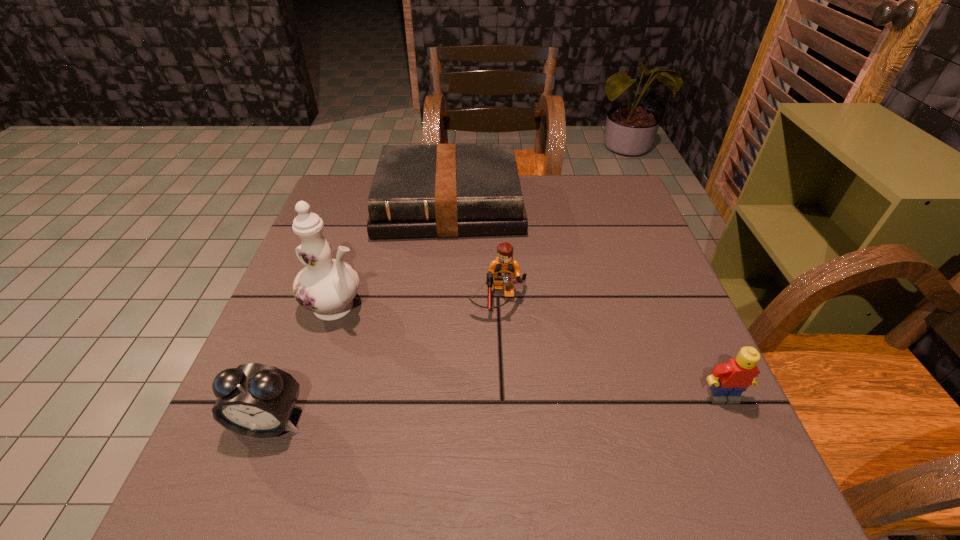
You are a GUI agent. You are given a task and a screenshot of the screen. Output one action in this format:
    pyautogui.click(x=<x>, y=<y>)
    Task: Click on the vacant space at the far left corner
    Image resolution: width=960 pixels, height=540 pixels.
    Given the screenshot: What is the action you would take?
    pyautogui.click(x=352, y=217)

Locate an element on the screen. This screenshot has height=540, width=960. free space at the far right corner of the desktop is located at coordinates (613, 217).

Locate an element on the screen. The image size is (960, 540). vacant point located between the farther Lego and the farthest object is located at coordinates (473, 253).

Identify the location of empty space that is in between the alarm clock and the tallest object. This screenshot has height=540, width=960. (303, 363).

The height and width of the screenshot is (540, 960). What are the coordinates of `vacant point located between the alarm clock and the left Lego` in the screenshot? It's located at (384, 361).

Image resolution: width=960 pixels, height=540 pixels. I want to click on free space between the alarm clock and the left Lego, so [x=384, y=361].

The height and width of the screenshot is (540, 960). What are the coordinates of `free space between the nearer Lego and the hardback book` in the screenshot? It's located at (586, 301).

Identify the location of free space between the farther Lego and the farthest object. This screenshot has width=960, height=540. (473, 253).

Find the location of a particular element. The image size is (960, 540). free space between the right Lego and the farther Lego is located at coordinates (611, 349).

The image size is (960, 540). In order to click on free point between the left Lego and the right Lego in this screenshot , I will do `click(611, 349)`.